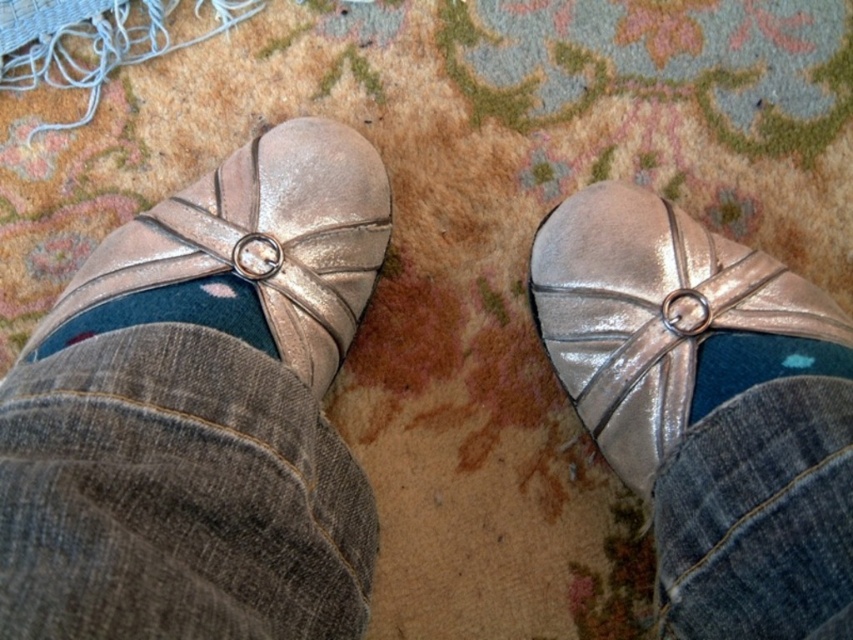
You are designing a shoe display stand and need to place both the blue soft sock at lower left and the blue denim sock at right next to each other. Based on their widths, which sock should you place on the left side to ensure they fit properly?

The blue soft sock at lower left might be wider than the blue denim sock at right, so placing the wider blue soft sock at lower left on the left side would ensure they fit properly on the display stand.

You are taking a photo of the metallic silver ballet flats and need to ensure the focus is sharp. The camera you are using has a depth of field that can clearly capture objects within 30 inches. Is the point at coordinate point (265,337) within the camera focus range?

The point at coordinate point (265,337) is 34.33 inches away from the camera, which is beyond the 30 inches depth of field range. Therefore, the point will not be in focus.

Looking at this image, you are trying to decide which pair of shoes to wear today. You have the shiny metallic shoe at center and the metallic leather shoe at left. Which one is smaller in size?

The shiny metallic shoe at center has a smaller size compared to the metallic leather shoe at left, so the shiny metallic shoe at center is the smaller one.